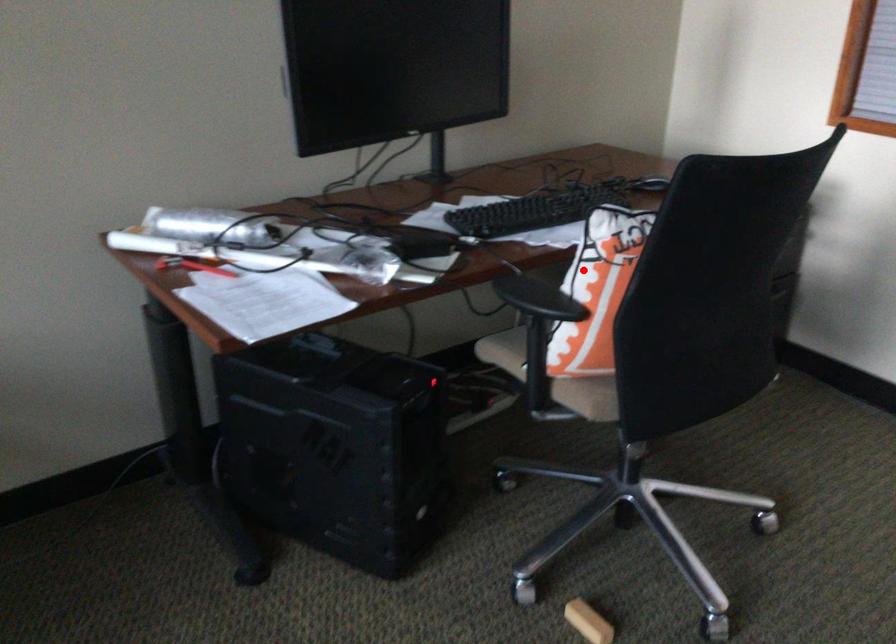
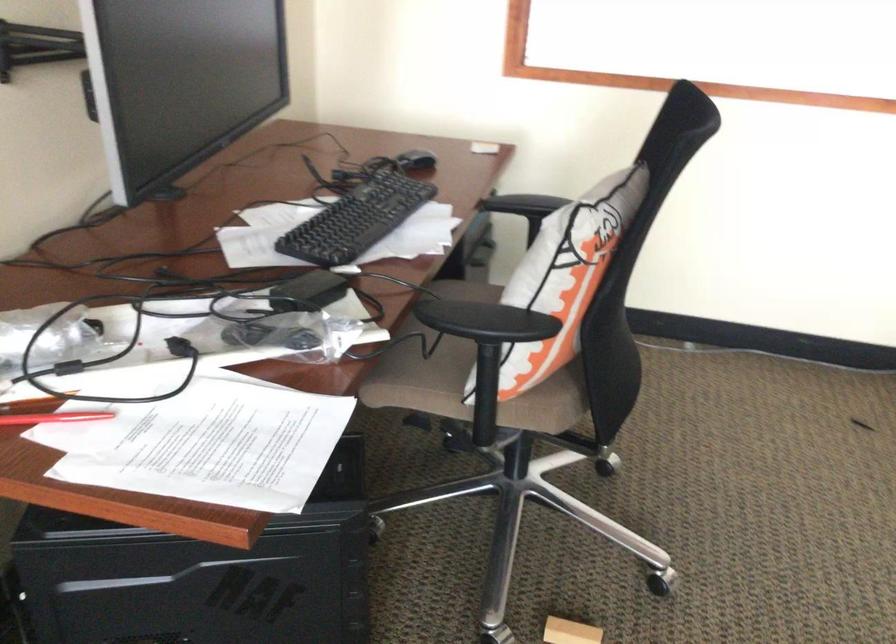
Question: A red point is marked in image1. In image2, is the corresponding 3D point closer to the camera or farther? Reply with the corresponding letter.

Choices:
 (A) The corresponding 3D point is closer.
 (B) The corresponding 3D point is farther.

Answer: (A)